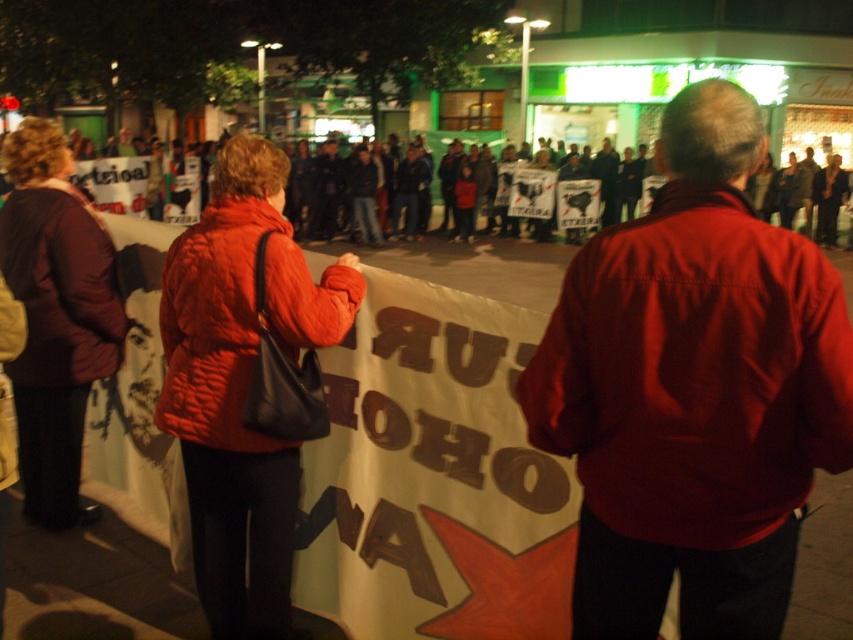
You are a photographer at the protest scene. You need to capture a photo that includes both the matte red jacket at center and the maroon fabric jacket at left. Based on their heights, which jacket will appear taller in the photo?

The maroon fabric jacket at left will appear taller in the photo because it is taller than the matte red jacket at center.

You are a photographer standing at the edge of the protest crowd. You want to take a photo that includes both the quilted red jacket at center and the maroon fabric jacket at left. Can you fit both jackets in the frame if your camera has a 3.5 feet wide field of view?

The quilted red jacket at center and the maroon fabric jacket at left are 3.38 feet apart. Since the distance between them is less than the camera field of view of 3.5 feet, both jackets can be captured in the frame.